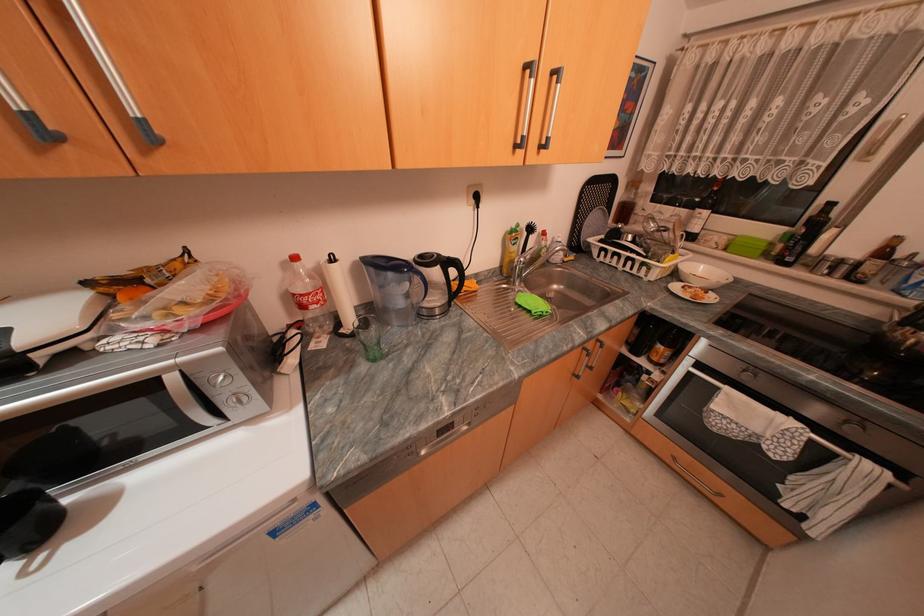
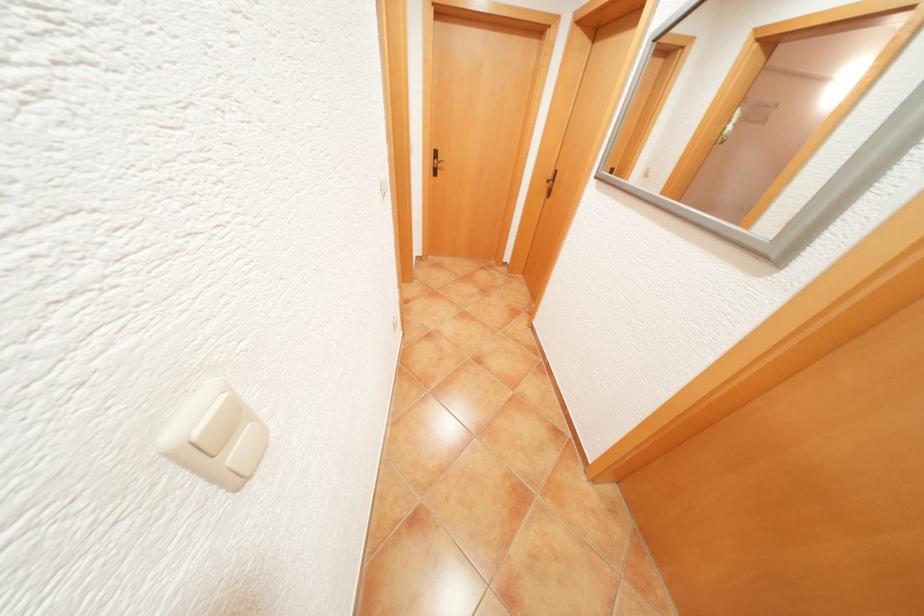
Question: I am providing you with two images of the same scene from different viewpoints. Which of the following objects are not visible in image2?

Choices:
 (A) machine side handle
 (B) black door handle
 (C) light switch rocker
 (D) silver cabinet handle

Answer: (D)